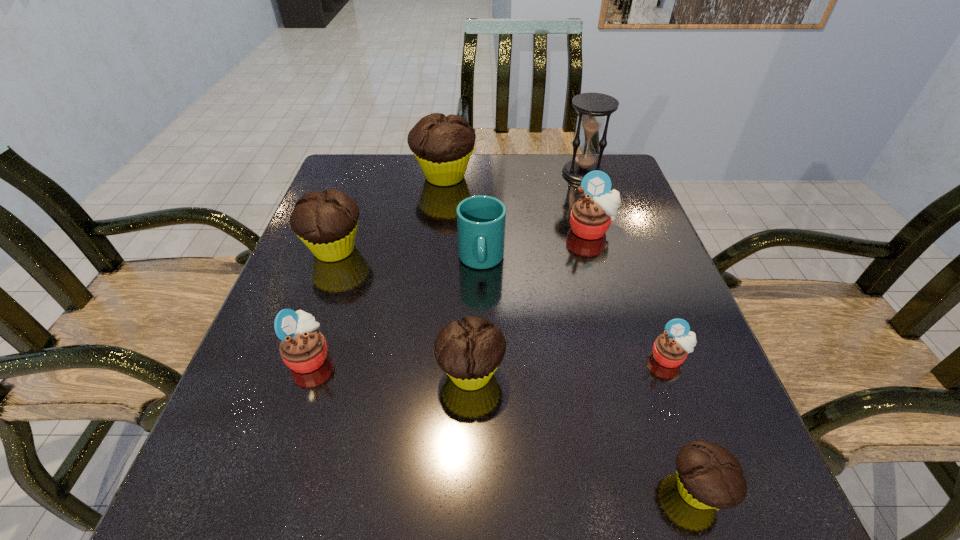
The image size is (960, 540). In the image, there is a desktop. Identify the location of vacant space at the left edge. (340, 327).

In the image, there is a desktop. Identify the location of vacant space at the right edge. (635, 302).

This screenshot has height=540, width=960. In order to click on free region at the far left corner of the desktop in this screenshot , I will do `click(338, 168)`.

At what (x,y) coordinates should I click in order to perform the action: click on free space between the second nearest chocolate muffin and the smallest pink muffin. Please return your answer as a coordinate pair (x, y). The width and height of the screenshot is (960, 540). Looking at the image, I should click on (570, 365).

You are a GUI agent. You are given a task and a screenshot of the screen. Output one action in this format:
    pyautogui.click(x=<x>, y=<y>)
    Task: Click on the vacant region between the second smallest pink muffin and the third farthest chocolate muffin
    This screenshot has height=540, width=960.
    Given the screenshot: What is the action you would take?
    pyautogui.click(x=390, y=364)

This screenshot has width=960, height=540. What are the coordinates of `vacant point located between the smallest pink muffin and the second biggest chocolate muffin` in the screenshot? It's located at (502, 303).

Locate an element on the screen. This screenshot has width=960, height=540. free space that is in between the third farthest chocolate muffin and the biggest chocolate muffin is located at coordinates (458, 275).

You are a GUI agent. You are given a task and a screenshot of the screen. Output one action in this format:
    pyautogui.click(x=<x>, y=<y>)
    Task: Click on the empty location between the cup and the rightmost chocolate muffin
    
    Given the screenshot: What is the action you would take?
    pyautogui.click(x=588, y=375)

At what (x,y) coordinates should I click in order to perform the action: click on vacant area that lies between the biggest chocolate muffin and the nearest object. Please return your answer as a coordinate pair (x, y). The height and width of the screenshot is (540, 960). Looking at the image, I should click on (570, 333).

In order to click on free space between the smallest chocolate muffin and the cup in this screenshot , I will do `click(588, 375)`.